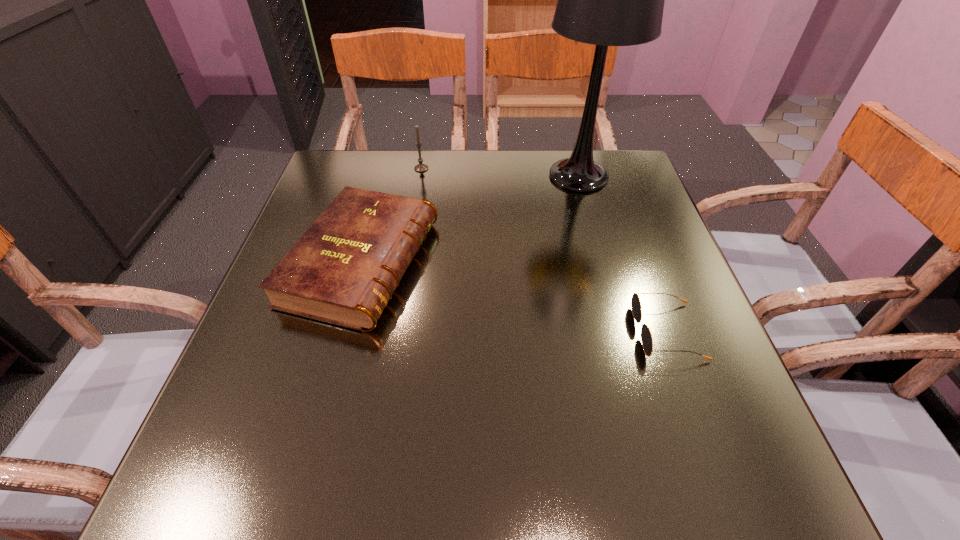
At what (x,y) coordinates should I click in order to perform the action: click on the tallest object. Please return your answer as a coordinate pair (x, y). The height and width of the screenshot is (540, 960). Looking at the image, I should click on (x=606, y=0).

Where is `candle`? candle is located at coordinates tap(420, 167).

Find the location of a particular element. This screenshot has width=960, height=540. hardback book is located at coordinates (344, 269).

Where is `the shortest object`? Image resolution: width=960 pixels, height=540 pixels. the shortest object is located at coordinates (647, 341).

I want to click on free point located on the front of the tallest object, so click(597, 242).

Where is `free location located on the left of the candle`? This screenshot has width=960, height=540. free location located on the left of the candle is located at coordinates (396, 168).

This screenshot has width=960, height=540. In order to click on vacant space situated on the right of the second shortest object in this screenshot , I will do `click(625, 263)`.

At what (x,y) coordinates should I click in order to perform the action: click on vacant space positioned 0.140m on the front-facing side of the shortest object. Please return your answer as a coordinate pair (x, y). Looking at the image, I should click on (559, 332).

The image size is (960, 540). I want to click on blank space located on the front-facing side of the shortest object, so click(559, 332).

Find the location of a particular element. This screenshot has height=540, width=960. vacant region located on the front-facing side of the shortest object is located at coordinates (526, 332).